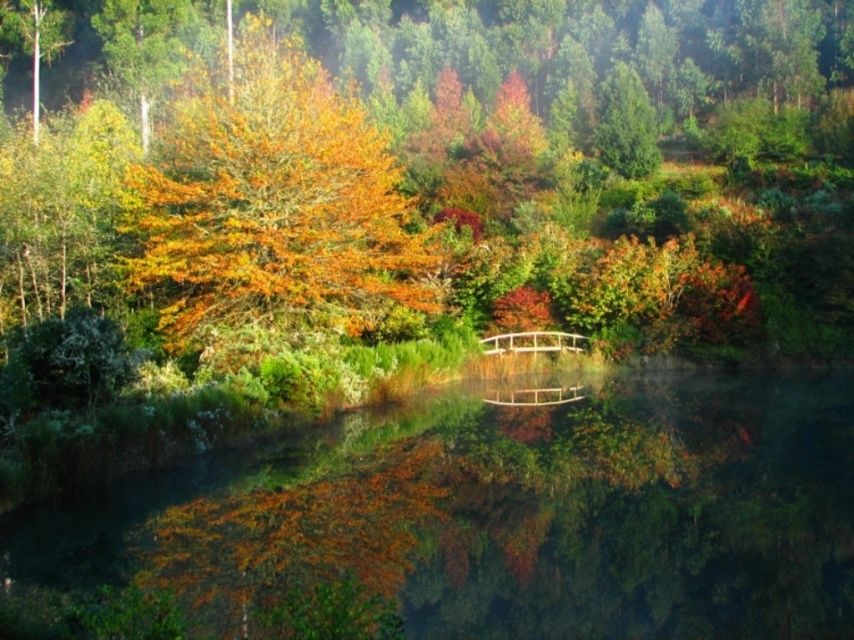
Question: Which object appears farthest from the camera in this image?

Choices:
 (A) green matte tree at upper right
 (B) orange matte tree at center

Answer: (A)

Question: Does orange matte tree at center have a greater width compared to green matte tree at upper right?

Choices:
 (A) no
 (B) yes

Answer: (B)

Question: Can you confirm if orange matte tree at center is wider than green matte tree at upper right?

Choices:
 (A) no
 (B) yes

Answer: (B)

Question: Considering the relative positions of orange matte tree at center and green matte tree at upper right in the image provided, where is orange matte tree at center located with respect to green matte tree at upper right?

Choices:
 (A) below
 (B) above

Answer: (B)